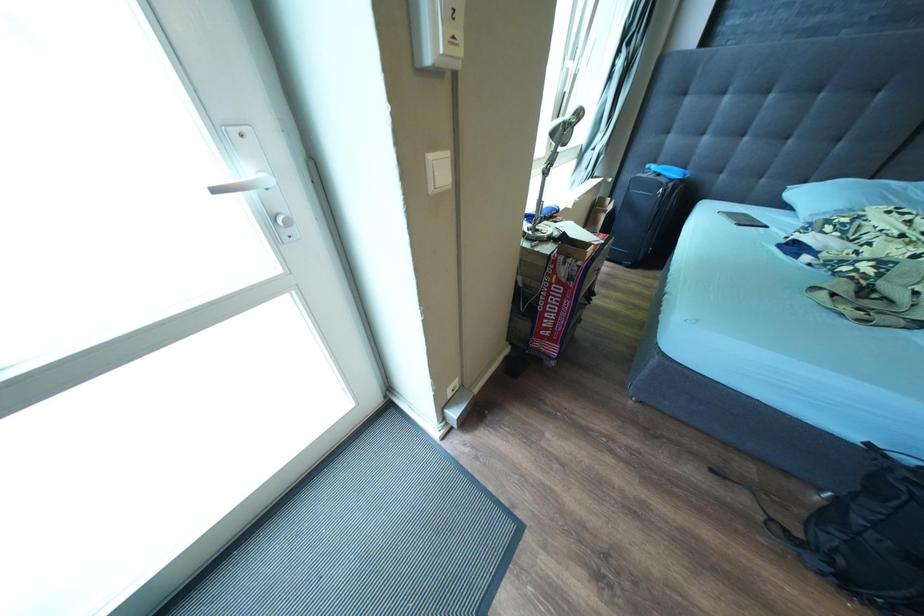
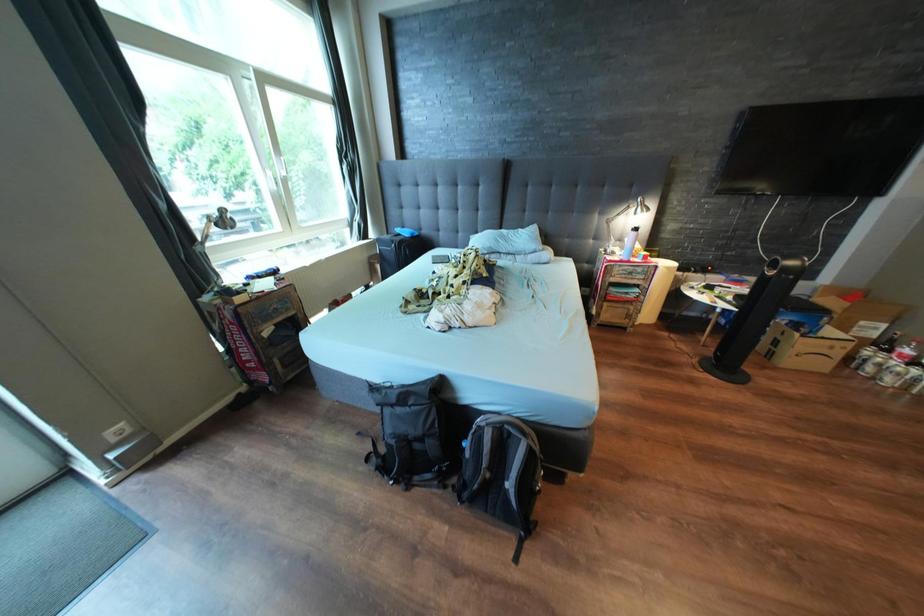
In a continuous first-person perspective shot, in which direction is the camera moving?

The movement direction of the cameraman is right, backward.